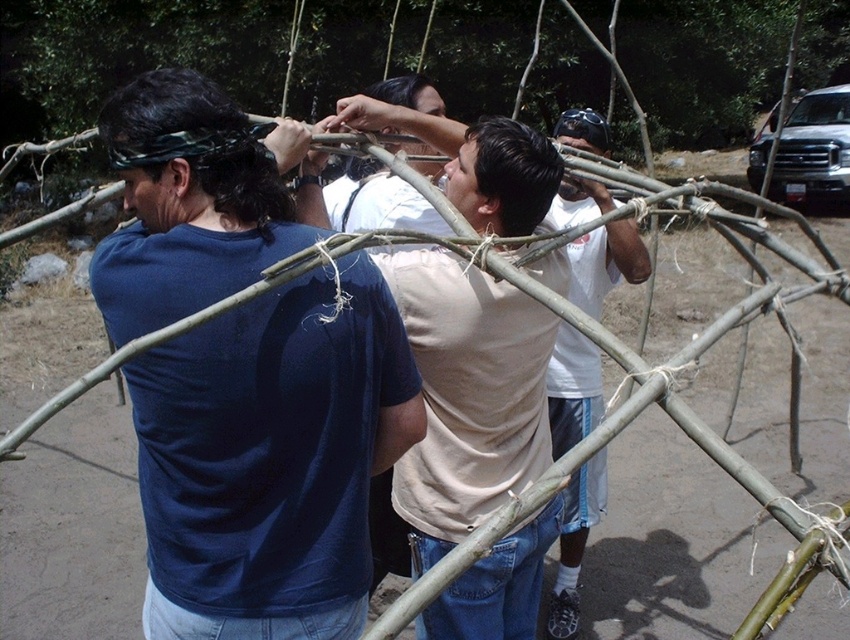
Question: Can you confirm if matte blue t-shirt at left is bigger than white cotton t-shirt at center?

Choices:
 (A) no
 (B) yes

Answer: (A)

Question: Among these points, which one is nearest to the camera?

Choices:
 (A) (632, 241)
 (B) (216, 269)

Answer: (B)

Question: Does matte blue t-shirt at left come behind white cotton t-shirt at center?

Choices:
 (A) no
 (B) yes

Answer: (A)

Question: Is matte blue t-shirt at left wider than white cotton t-shirt at center?

Choices:
 (A) no
 (B) yes

Answer: (B)

Question: Which point appears farthest from the camera in this image?

Choices:
 (A) (238, 202)
 (B) (596, 128)

Answer: (B)